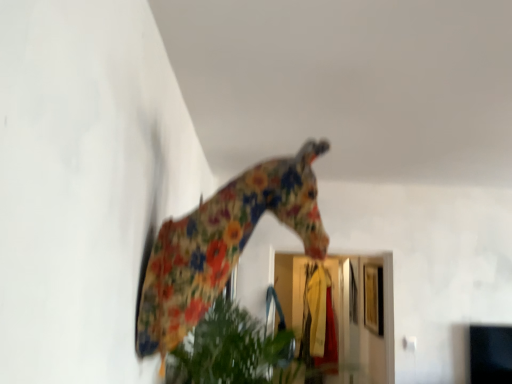
Question: Is transparent glass door at center facing towards floral fabric giraffe at center?

Choices:
 (A) no
 (B) yes

Answer: (B)

Question: Are transparent glass door at center and floral fabric giraffe at center making contact?

Choices:
 (A) no
 (B) yes

Answer: (A)

Question: Considering the relative positions of transparent glass door at center and floral fabric giraffe at center in the image provided, is transparent glass door at center behind floral fabric giraffe at center?

Choices:
 (A) yes
 (B) no

Answer: (A)

Question: Does transparent glass door at center appear on the right side of floral fabric giraffe at center?

Choices:
 (A) yes
 (B) no

Answer: (A)

Question: Is transparent glass door at center completely or partially outside of floral fabric giraffe at center?

Choices:
 (A) yes
 (B) no

Answer: (A)

Question: Considering the relative positions of transparent glass door at center and floral fabric giraffe at center in the image provided, is transparent glass door at center to the left of floral fabric giraffe at center from the viewer's perspective?

Choices:
 (A) yes
 (B) no

Answer: (B)

Question: Is floral fabric giraffe at center thinner than transparent glass door at center?

Choices:
 (A) yes
 (B) no

Answer: (B)

Question: Is floral fabric giraffe at center turned away from transparent glass door at center?

Choices:
 (A) no
 (B) yes

Answer: (A)

Question: From a real-world perspective, is floral fabric giraffe at center located beneath transparent glass door at center?

Choices:
 (A) yes
 (B) no

Answer: (B)

Question: Is floral fabric giraffe at center further to camera compared to transparent glass door at center?

Choices:
 (A) no
 (B) yes

Answer: (A)

Question: Can you confirm if floral fabric giraffe at center is positioned to the left of transparent glass door at center?

Choices:
 (A) no
 (B) yes

Answer: (B)

Question: Are floral fabric giraffe at center and transparent glass door at center far apart?

Choices:
 (A) no
 (B) yes

Answer: (B)

Question: Which is correct: floral fabric giraffe at center is inside transparent glass door at center, or outside of it?

Choices:
 (A) inside
 (B) outside

Answer: (B)